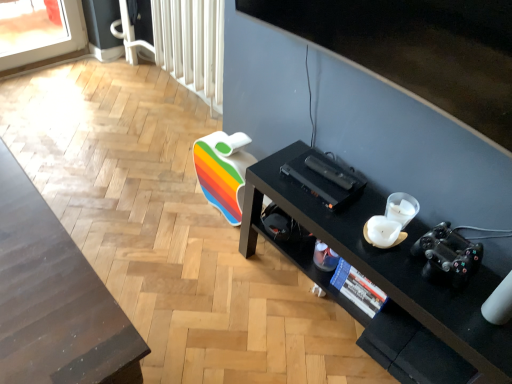
Question: Is black matte desk at lower right bigger or smaller than black matte video camera at lower right?

Choices:
 (A) big
 (B) small

Answer: (A)

Question: Is black matte desk at lower right in front of or behind black matte video camera at lower right in the image?

Choices:
 (A) behind
 (B) front

Answer: (B)

Question: Which object is the farthest from the black matte video camera at lower right?

Choices:
 (A) shiny dark wood table at lower left
 (B) black matte desk at lower right
 (C) white plastic radiator at upper center

Answer: (C)

Question: Based on their relative distances, which object is nearer to the white plastic radiator at upper center?

Choices:
 (A) black matte desk at lower right
 (B) shiny dark wood table at lower left
 (C) black matte video camera at lower right

Answer: (A)